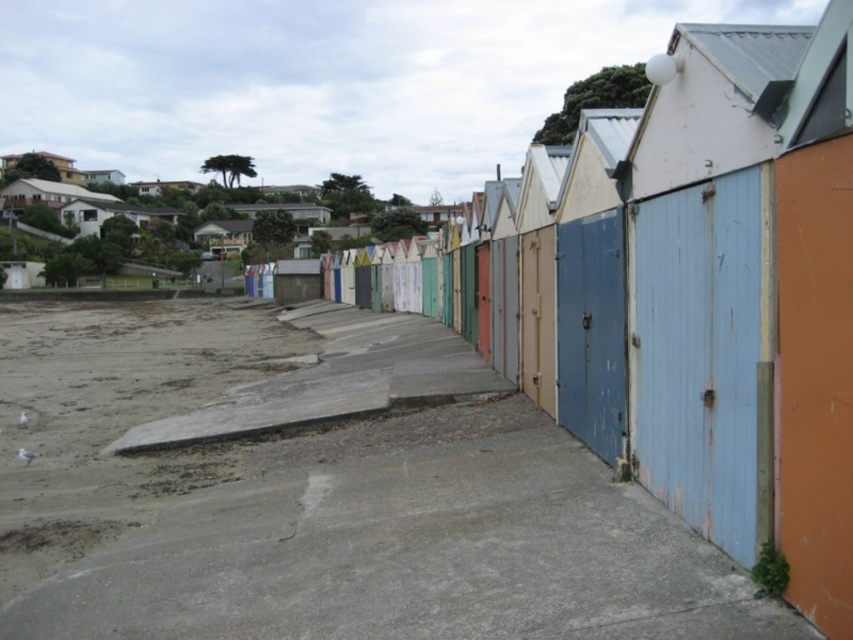
Is point (711, 602) in front of point (148, 404)?

Yes, it is.

How far apart are smooth concrete walkway at center and gray sandy beach at lower left?

smooth concrete walkway at center and gray sandy beach at lower left are 2.36 meters apart from each other.

Between point (9, 355) and point (103, 316), which one is positioned behind?

The point (103, 316) is behind.

What are the coordinates of `smooth concrete walkway at center` in the screenshot? It's located at point(321,492).